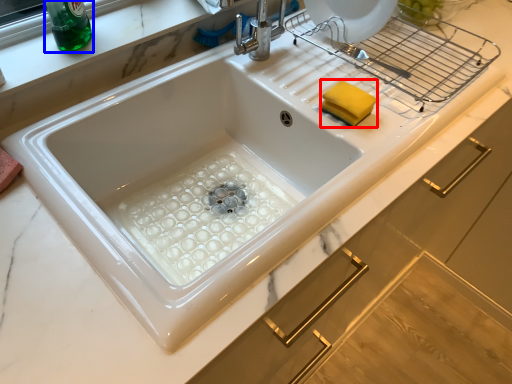
Question: Which of the following is the farthest to the observer, food (highlighted by a red box) or beverage (highlighted by a blue box)?

Choices:
 (A) food
 (B) beverage

Answer: (A)